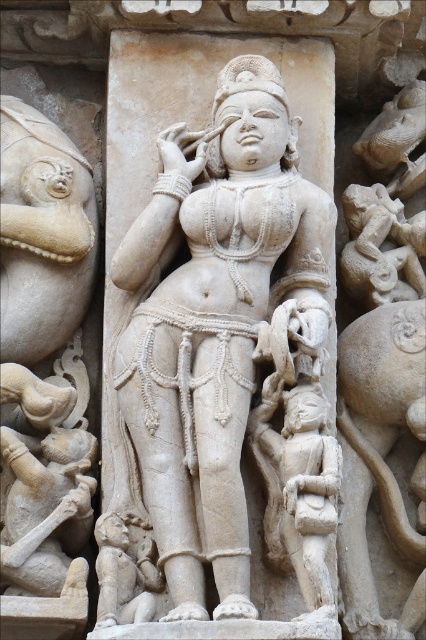
Question: Among these objects, which one is farthest from the camera?

Choices:
 (A) white marble child at lower left
 (B) carved stone figure at center

Answer: (A)

Question: Observing the image, what is the correct spatial positioning of white marble statue at center in reference to carved stone figure at center?

Choices:
 (A) right
 (B) left

Answer: (B)

Question: Can you confirm if white marble statue at center is smaller than white marble child at lower left?

Choices:
 (A) no
 (B) yes

Answer: (A)

Question: Which of the following is the farthest from the observer?

Choices:
 (A) white marble statue at center
 (B) white marble child at lower left

Answer: (B)

Question: Is white marble statue at center above white marble child at lower left?

Choices:
 (A) no
 (B) yes

Answer: (B)

Question: Estimate the real-world distances between objects in this image. Which object is closer to the white marble child at lower left?

Choices:
 (A) carved stone figure at center
 (B) white marble statue at center

Answer: (B)